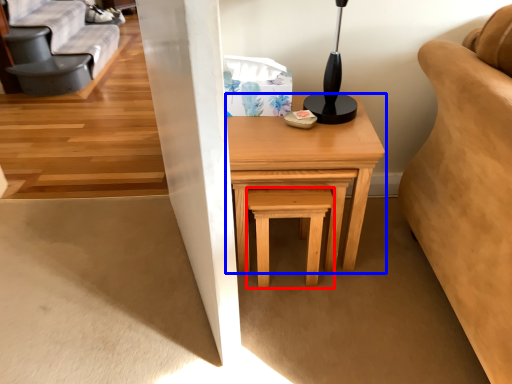
Question: Which of the following is the farthest to the observer, stool (highlighted by a red box) or table (highlighted by a blue box)?

Choices:
 (A) stool
 (B) table

Answer: (A)